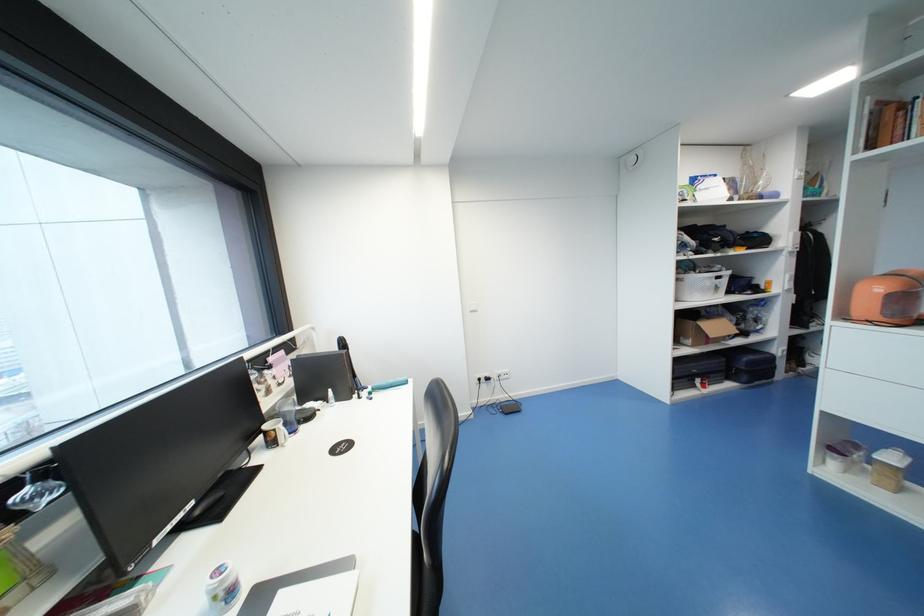
Which object does [700,283] point to?

It corresponds to the white plastic basket in the image.